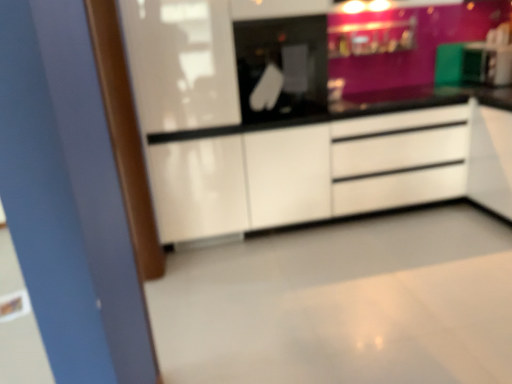
Question: Considering the positions of point (400, 193) and point (268, 49), is point (400, 193) closer or farther from the camera than point (268, 49)?

Choices:
 (A) farther
 (B) closer

Answer: (A)

Question: In terms of size, does white glossy chest of drawers at center appear bigger or smaller than black glass microwave at center?

Choices:
 (A) big
 (B) small

Answer: (A)

Question: From a real-world perspective, is white glossy chest of drawers at center above or below black glass microwave at center?

Choices:
 (A) above
 (B) below

Answer: (B)

Question: Relative to white glossy chest of drawers at center, is black glass microwave at center in front or behind?

Choices:
 (A) behind
 (B) front

Answer: (B)

Question: Considering the positions of black glass microwave at center and white glossy chest of drawers at center in the image, is black glass microwave at center wider or thinner than white glossy chest of drawers at center?

Choices:
 (A) wide
 (B) thin

Answer: (B)

Question: Is black glass microwave at center spatially inside white glossy chest of drawers at center, or outside of it?

Choices:
 (A) inside
 (B) outside

Answer: (B)

Question: From their relative heights in the image, would you say black glass microwave at center is taller or shorter than white glossy chest of drawers at center?

Choices:
 (A) short
 (B) tall

Answer: (A)